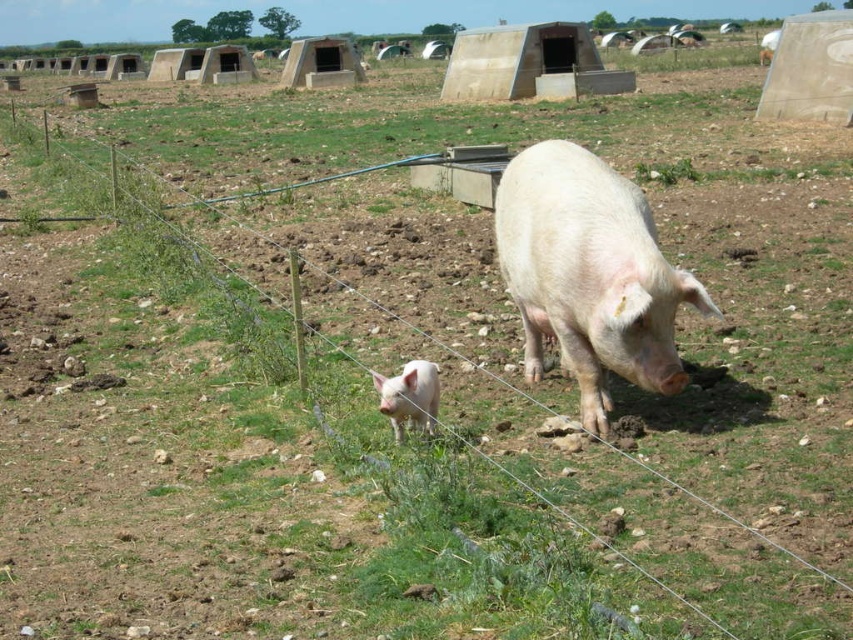
Who is taller, pink smooth pig at center or white matte piglet at lower center?

Standing taller between the two is pink smooth pig at center.

Does pink smooth pig at center have a greater width compared to white matte piglet at lower center?

Yes, pink smooth pig at center is wider than white matte piglet at lower center.

Locate an element on the screen. pink smooth pig at center is located at coordinates (589, 275).

Where is `pink smooth pig at center`? The image size is (853, 640). pink smooth pig at center is located at coordinates [x=589, y=275].